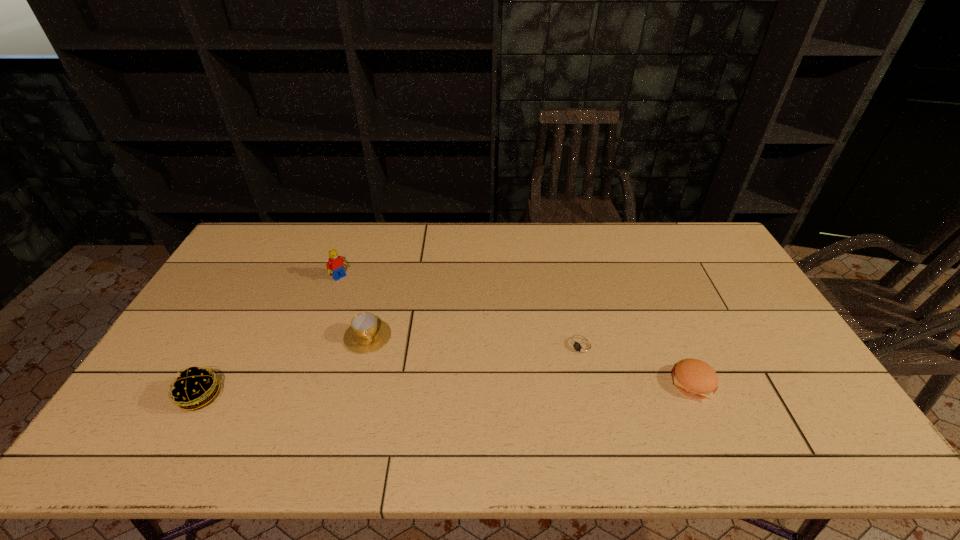
You are a GUI agent. You are given a task and a screenshot of the screen. Output one action in this format:
    pyautogui.click(x=<x>, y=<y>)
    Task: Click on the blank space located on the left of the fourth tallest object
    This screenshot has width=960, height=540.
    Given the screenshot: What is the action you would take?
    pyautogui.click(x=540, y=383)

The height and width of the screenshot is (540, 960). I want to click on vacant space located with the handle on the side of the third object from right to left, so (379, 369).

Where is `free space located 0.170m with the handle on the side of the third object from right to left`? free space located 0.170m with the handle on the side of the third object from right to left is located at coordinates (390, 401).

What are the coordinates of `vacant space located with the handle on the side of the third object from right to left` in the screenshot? It's located at (384, 383).

The height and width of the screenshot is (540, 960). I want to click on free spot located on the face of the shortest object, so click(x=533, y=379).

Locate an element on the screen. free space located on the face of the shortest object is located at coordinates (512, 392).

I want to click on free point located 0.190m on the face of the shortest object, so click(515, 390).

Image resolution: width=960 pixels, height=540 pixels. Find the location of `vacant area situated on the face of the fourth object from right to left`. vacant area situated on the face of the fourth object from right to left is located at coordinates (361, 295).

The height and width of the screenshot is (540, 960). Identify the location of free location located on the face of the fourth object from right to left. (387, 319).

This screenshot has height=540, width=960. I want to click on free region located on the face of the fourth object from right to left, so click(400, 331).